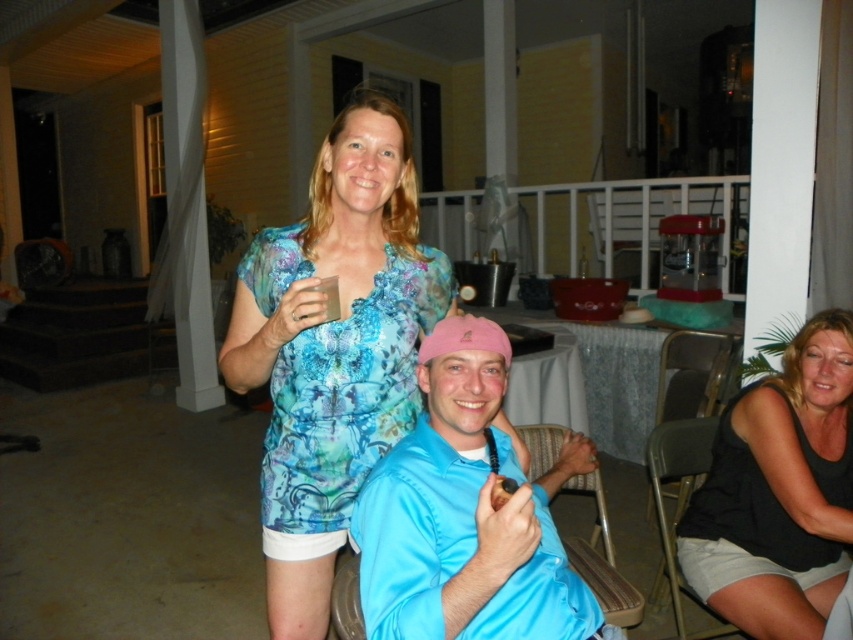
You are standing on the porch and want to place a decorative plant pot between the metallic gray chair at lower right and the woven fabric chair at center. Based on their positions, where should you place the plant pot?

The metallic gray chair at lower right is located above the woven fabric chair at center, so you should place the plant pot between them either above or below depending on desired placement. However, since the chairs are vertically aligned with the metallic gray chair higher up, placing the plant pot below the metallic gray chair at lower right and above the woven fabric chair at center would logically position it between them.

You are at the backyard party and want to find the metallic gray chair at lower right. According to the image coordinates, where exactly is it located?

The metallic gray chair at lower right is located at point (693, 372).

You are a photographer at the event and want to capture a photo of the textured blue blouse at center without the black fabric chair at lower right appearing in the background. Is this possible based on their positions?

The textured blue blouse at center is positioned over the black fabric chair at lower right, so the chair would likely be visible behind the blouse in the photo.